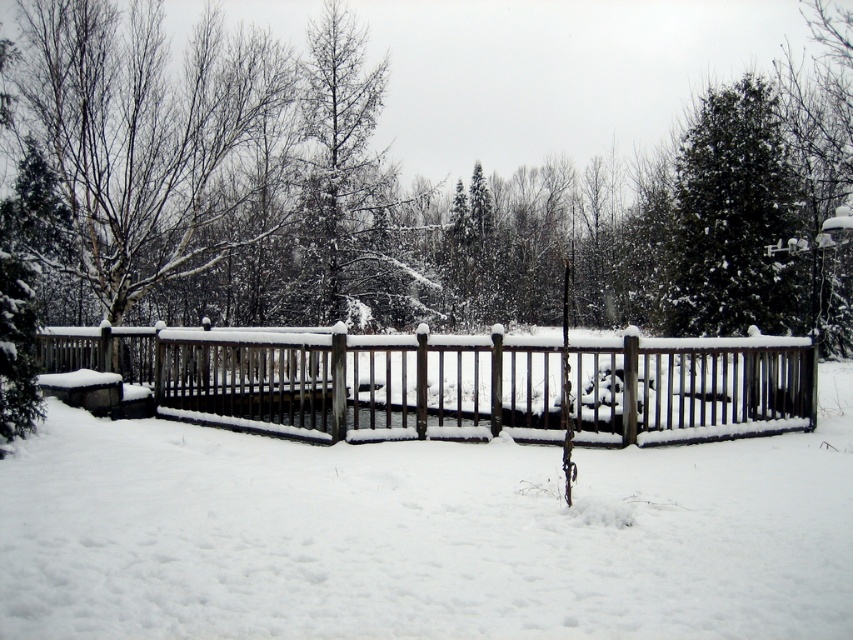
Can you confirm if white wooden fence at center is positioned to the right of wooden fence at center?

Correct, you'll find white wooden fence at center to the right of wooden fence at center.

Measure the distance between white wooden fence at center and camera.

white wooden fence at center and camera are 28.76 feet apart.

Where is `white wooden fence at center`? The image size is (853, 640). white wooden fence at center is located at coordinates (405, 536).

Which of these two, white wooden fence at center or green matte evergreen tree at upper right, stands shorter?

With less height is white wooden fence at center.

Between white wooden fence at center and green matte evergreen tree at upper right, which one appears on the left side from the viewer's perspective?

Positioned to the left is white wooden fence at center.

Is point (178, 548) farther from camera compared to point (717, 198)?

No.

I want to click on white wooden fence at center, so click(x=405, y=536).

Is wooden fence at center shorter than green matte evergreen tree at upper right?

A: No.

Does point (461, 417) come in front of point (686, 310)?

Yes, point (461, 417) is closer to viewer.

At what (x,y) coordinates should I click in order to perform the action: click on wooden fence at center. Please return your answer as a coordinate pair (x, y). The height and width of the screenshot is (640, 853). Looking at the image, I should click on (329, 378).